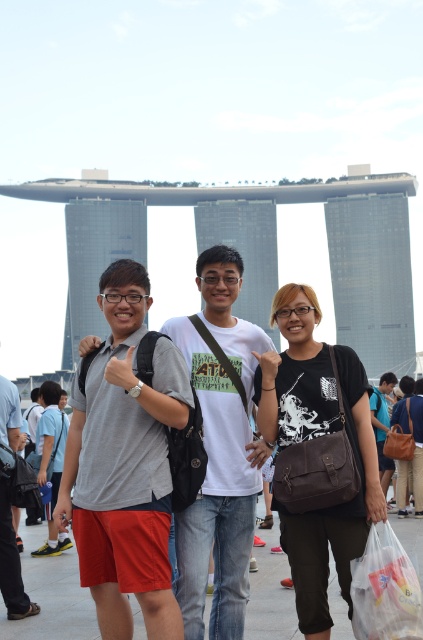
You are a photographer trying to capture a detailed shot of the brown leather bag at center and the matte brown bag at center. Which bag should you focus on first if you want to photograph them from left to right in the order they appear in the scene?

The matte brown bag at center should be focused on first because it is positioned to the left of the brown leather bag at center.

You are a photographer trying to capture a group photo of the matte gray shirt at center and the matte brown bag at center. If you want to ensure both subjects are in focus, which one should you adjust your camera focus to prioritize based on their sizes?

The matte gray shirt at center has a smaller width than the matte brown bag at center, so you should prioritize focusing on the matte gray shirt at center to ensure both are in focus.

You are a photographer trying to capture a photo of the matte gray shirt at center and the matte brown bag at center. Based on their positions, which object should you focus on first to ensure both are in frame?

The matte gray shirt at center is above the matte brown bag at center, so you should focus on the matte gray shirt at center first to ensure both are in frame.